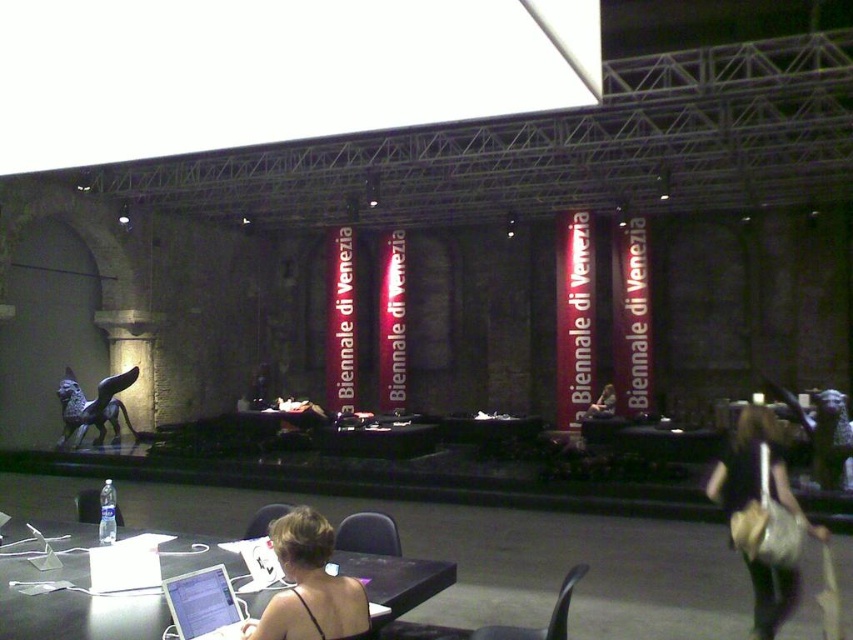
This screenshot has height=640, width=853. I want to click on black fabric hair at center, so click(309, 586).

Who is positioned more to the left, black fabric hair at center or matte black chair at center?

→ From the viewer's perspective, matte black chair at center appears more on the left side.

Which is in front, point (311, 554) or point (260, 525)?

Point (311, 554) is more forward.

Locate an element on the screen. black fabric hair at center is located at coordinates (309, 586).

Can you confirm if black fabric hair at center is positioned to the right of black plastic chair at center?

In fact, black fabric hair at center is to the left of black plastic chair at center.

Which is more to the left, black fabric hair at center or black plastic chair at center?

Positioned to the left is black fabric hair at center.

Between point (296, 579) and point (360, 531), which one is positioned behind?

Positioned behind is point (360, 531).

This screenshot has width=853, height=640. What are the coordinates of `black fabric hair at center` in the screenshot? It's located at (309, 586).

The width and height of the screenshot is (853, 640). Describe the element at coordinates (86, 506) in the screenshot. I see `black plastic chair at lower center` at that location.

Between black plastic chair at lower center and matte black chair at center, which one appears on the right side from the viewer's perspective?

matte black chair at center is more to the right.

Is point (115, 506) positioned behind point (286, 508)?

That is True.

Find the location of `black plastic chair at lower center`. black plastic chair at lower center is located at coordinates (86, 506).